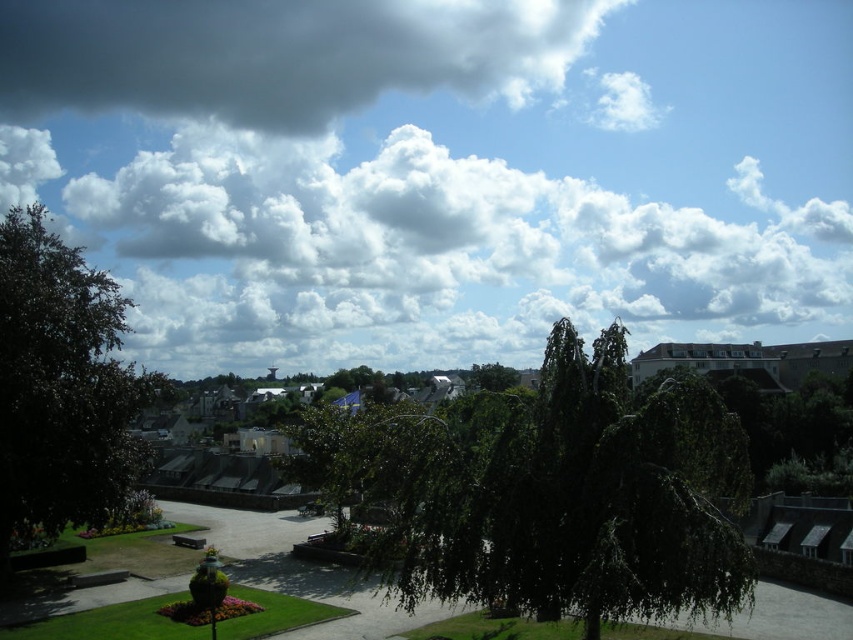
You are standing in the park and looking at the sky. There is a point marked at coordinates (279,54). What object is located at that point?

The point at coordinates (279,54) corresponds to a dark gray fluffy cloud at upper center.

Consider the image. You are standing at the camera position and want to walk directly to the dark green leafy tree at center. How many steps would you need to take if each step covers approximately 3 feet?

The distance between the dark green leafy tree at center and the camera is 75.09 feet. Since each step covers about 3 feet, dividing 75.09 by 3 gives approximately 25 steps. Therefore, you would need to take around 25 steps to reach the dark green leafy tree at center.